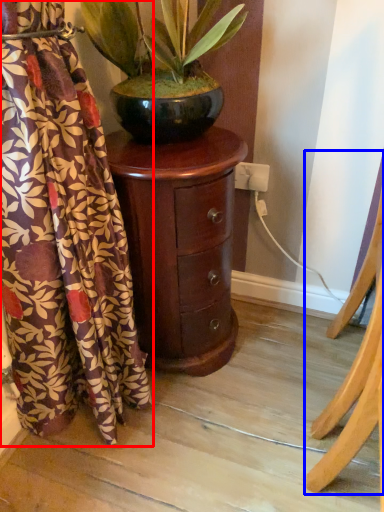
Question: Which point is further to the camera, curtain (highlighted by a red box) or furniture (highlighted by a blue box)?

Choices:
 (A) curtain
 (B) furniture

Answer: (B)